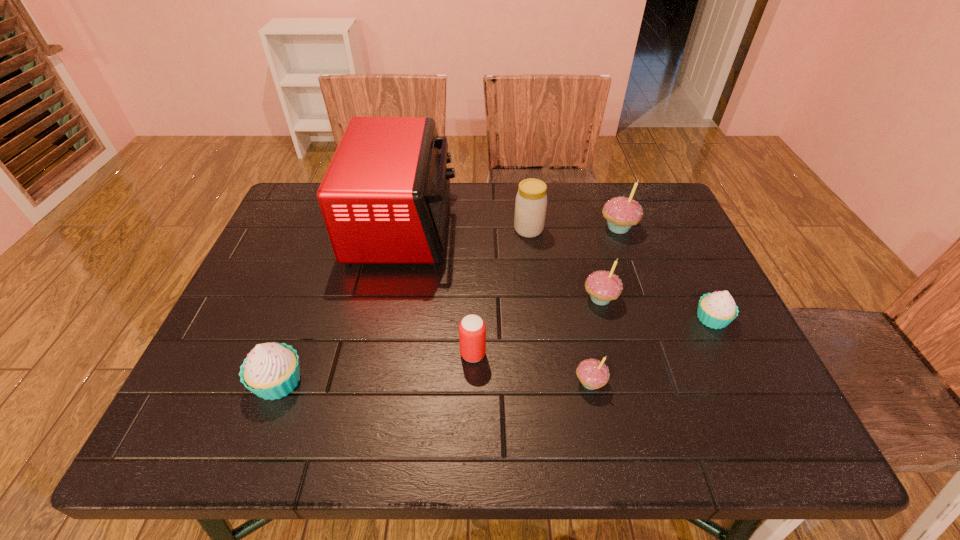
Where is `vacant region located on the right of the smallest pink cupcake`? vacant region located on the right of the smallest pink cupcake is located at coordinates (631, 383).

Image resolution: width=960 pixels, height=540 pixels. Identify the location of toaster oven positioned at the far edge. (384, 198).

The width and height of the screenshot is (960, 540). Identify the location of cupcake at the far edge. (621, 213).

I want to click on jar that is at the far edge, so click(531, 200).

The height and width of the screenshot is (540, 960). Find the location of `object that is at the near edge`. object that is at the near edge is located at coordinates (271, 371).

This screenshot has height=540, width=960. Find the location of `object at the left edge`. object at the left edge is located at coordinates (271, 371).

Locate an element on the screen. The width and height of the screenshot is (960, 540). object located at the near left corner is located at coordinates pos(271,371).

The width and height of the screenshot is (960, 540). In order to click on object that is at the far right corner in this screenshot , I will do `click(621, 213)`.

You are a GUI agent. You are given a task and a screenshot of the screen. Output one action in this format:
    pyautogui.click(x=<x>, y=<y>)
    Task: Click on the vacant point at the far edge
    The width and height of the screenshot is (960, 540).
    Given the screenshot: What is the action you would take?
    click(565, 192)

Locate an element on the screen. The image size is (960, 540). vacant space at the near edge is located at coordinates (x=553, y=422).